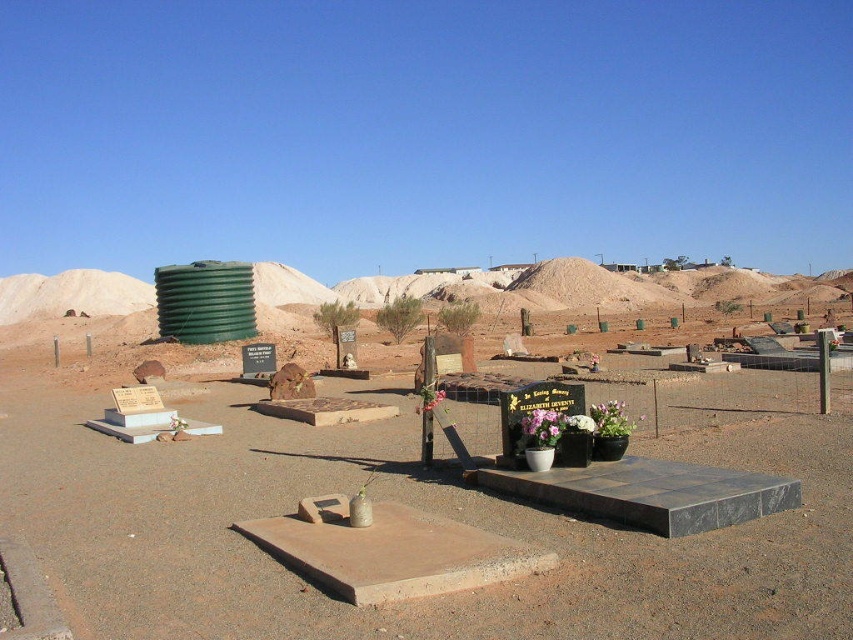
Question: Considering the real-world distances, which object is closest to the purple fabric flower at center?

Choices:
 (A) green leafy bush at center
 (B) white ceramic vase at center

Answer: (B)

Question: Is green leafy shrub at center below white ceramic vase at center?

Choices:
 (A) no
 (B) yes

Answer: (A)

Question: Considering the real-world distances, which object is farthest from the white ceramic vase at center?

Choices:
 (A) green leafy bush at center
 (B) green leafy shrub at center
 (C) purple fabric flower at center

Answer: (A)

Question: Which point appears farthest from the camera in this image?

Choices:
 (A) (445, 320)
 (B) (547, 422)
 (C) (567, 417)
 (D) (405, 324)

Answer: (A)

Question: Can you confirm if purple fabric flower at center is smaller than green leafy bush at center?

Choices:
 (A) yes
 (B) no

Answer: (A)

Question: Can you confirm if green leafy shrub at center is positioned to the left of purple fabric flower at center?

Choices:
 (A) no
 (B) yes

Answer: (B)